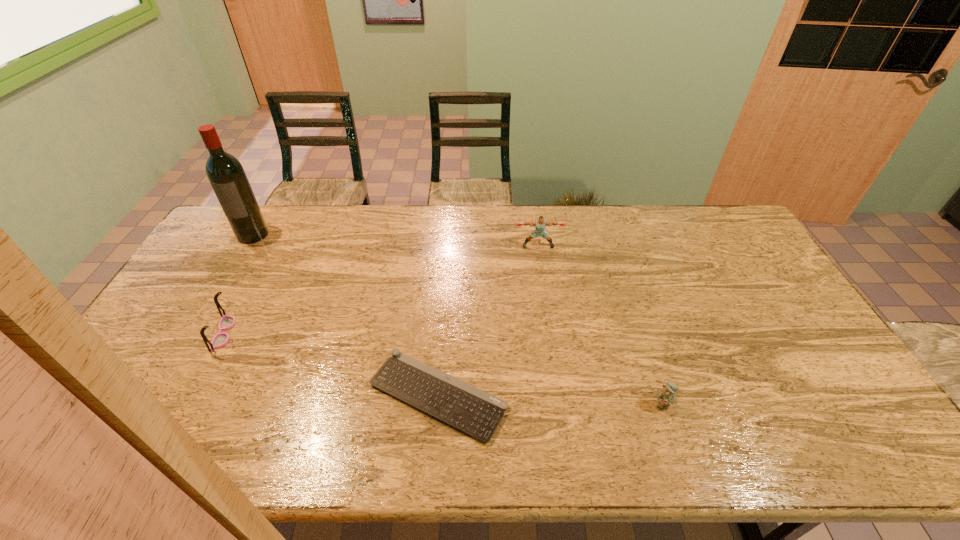
Find the location of a particular element. The image size is (960, 540). free space between the wine bottle and the fourth object from left to right is located at coordinates click(x=396, y=240).

Where is `empty space between the fourth object from left to right and the tallest object`? The height and width of the screenshot is (540, 960). empty space between the fourth object from left to right and the tallest object is located at coordinates (396, 240).

At what (x,y) coordinates should I click in order to perform the action: click on free point between the computer keyboard and the tallest object. Please return your answer as a coordinate pair (x, y). The width and height of the screenshot is (960, 540). Looking at the image, I should click on (346, 315).

You are a GUI agent. You are given a task and a screenshot of the screen. Output one action in this format:
    pyautogui.click(x=<x>, y=<y>)
    Task: Click on the vacant region between the spectacles and the third object from left to right
    
    Given the screenshot: What is the action you would take?
    pyautogui.click(x=330, y=364)

Identify the location of object that is the second closest to the shortest object. (220, 339).

Choose which object is the second nearest neighbor to the rightmost object. Please provide its 2D coordinates. Your answer should be formatted as a tuple, i.e. [(x, y)], where the tuple contains the x and y coordinates of a point satisfying the conditions above.

[(540, 224)]

Find the location of a particular element. This screenshot has width=960, height=540. vacant position in the image that satisfies the following two spatial constraints: 1. on the label of the wine bottle; 2. on the right side of the computer keyboard is located at coordinates (157, 395).

Locate an element on the screen. This screenshot has width=960, height=540. vacant region that satisfies the following two spatial constraints: 1. on the label of the tallest object; 2. on the right side of the third nearest object is located at coordinates (195, 333).

Locate an element on the screen. Image resolution: width=960 pixels, height=540 pixels. vacant space that satisfies the following two spatial constraints: 1. on the label of the computer keyboard; 2. on the left side of the tallest object is located at coordinates pyautogui.click(x=157, y=395).